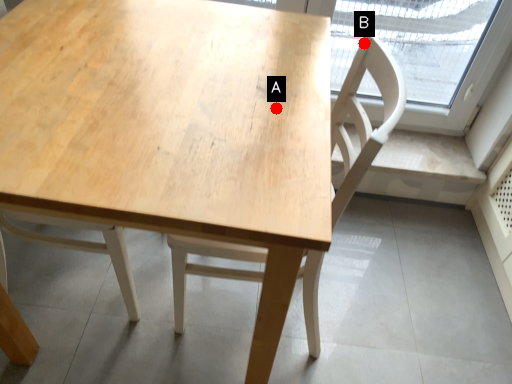
Question: Two points are circled on the image, labeled by A and B beside each circle. Which point is closer to the camera?

Choices:
 (A) A is closer
 (B) B is closer

Answer: (A)